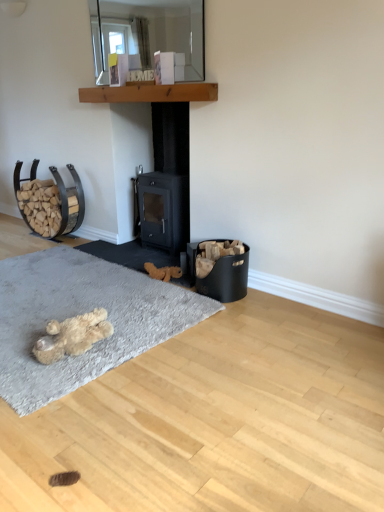
Locate an element on the screen. This screenshot has width=384, height=512. vacant space behind fuzzy beige teddy bear at lower left, which is the first animal from front to back is located at coordinates (104, 308).